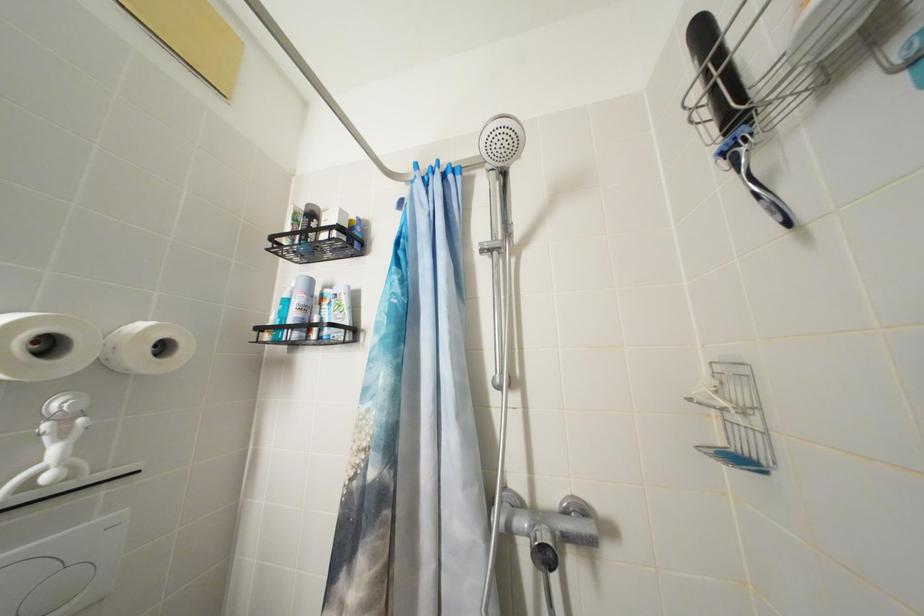
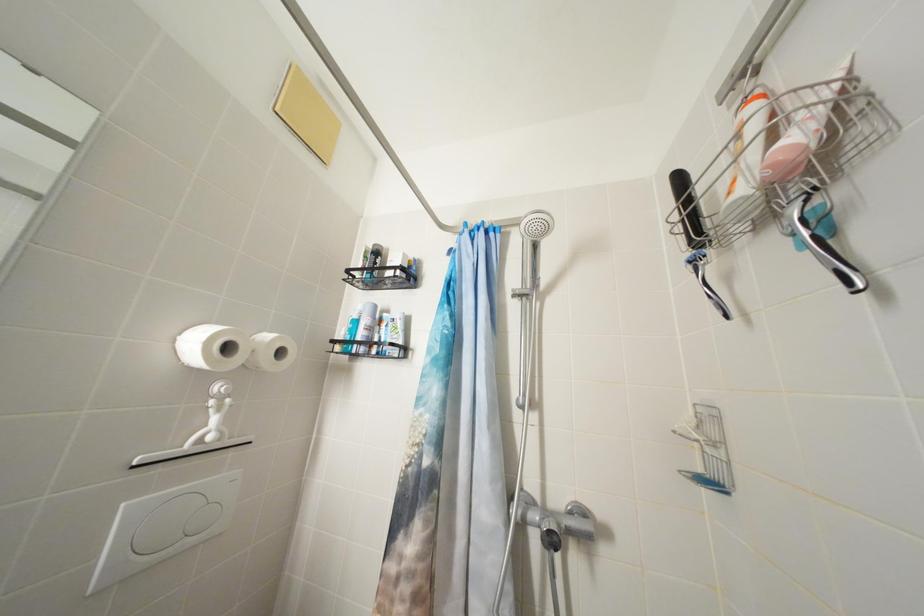
What movement of the cameraman would produce the second image?

The cameraman moved toward left, backward.